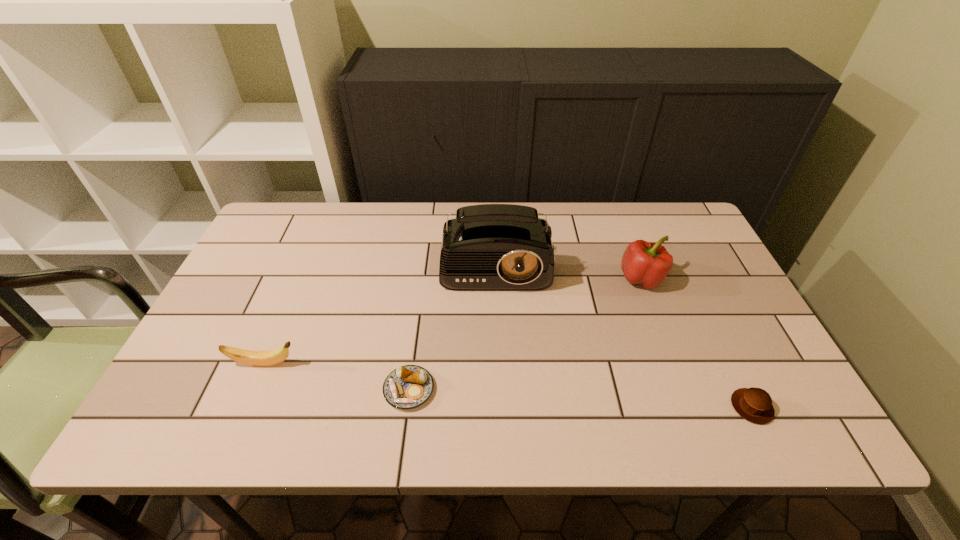
Image resolution: width=960 pixels, height=540 pixels. I want to click on radio receiver, so click(490, 247).

The height and width of the screenshot is (540, 960). What are the coordinates of `bell pepper` in the screenshot? It's located at (645, 263).

Identify the location of the fourth shortest object. (645, 263).

Identify the location of the third tallest object. The image size is (960, 540). (258, 358).

Locate an element on the screen. This screenshot has width=960, height=540. banana is located at coordinates (258, 358).

This screenshot has height=540, width=960. Identify the location of the fourth tallest object. (753, 404).

This screenshot has height=540, width=960. In order to click on muffin in this screenshot , I will do `click(753, 404)`.

Where is `the shortest object`? The width and height of the screenshot is (960, 540). the shortest object is located at coordinates (407, 387).

Find the location of a particular element. The image size is (960, 540). vacant space situated on the front-facing side of the radio receiver is located at coordinates (499, 339).

You are a GUI agent. You are given a task and a screenshot of the screen. Output one action in this format:
    pyautogui.click(x=<x>, y=<y>)
    Task: Click on the free region located 0.200m on the back of the bell pepper
    
    Given the screenshot: What is the action you would take?
    pyautogui.click(x=620, y=221)